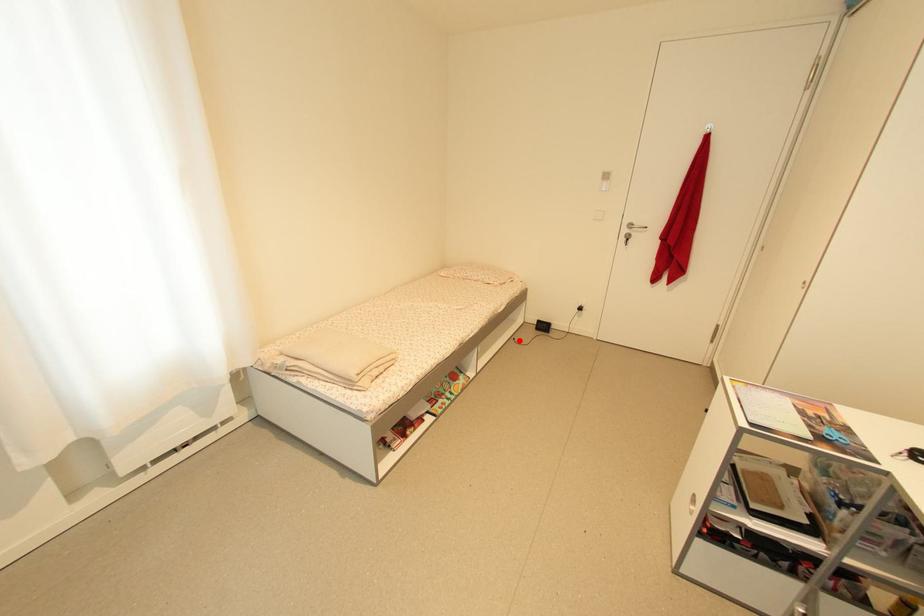
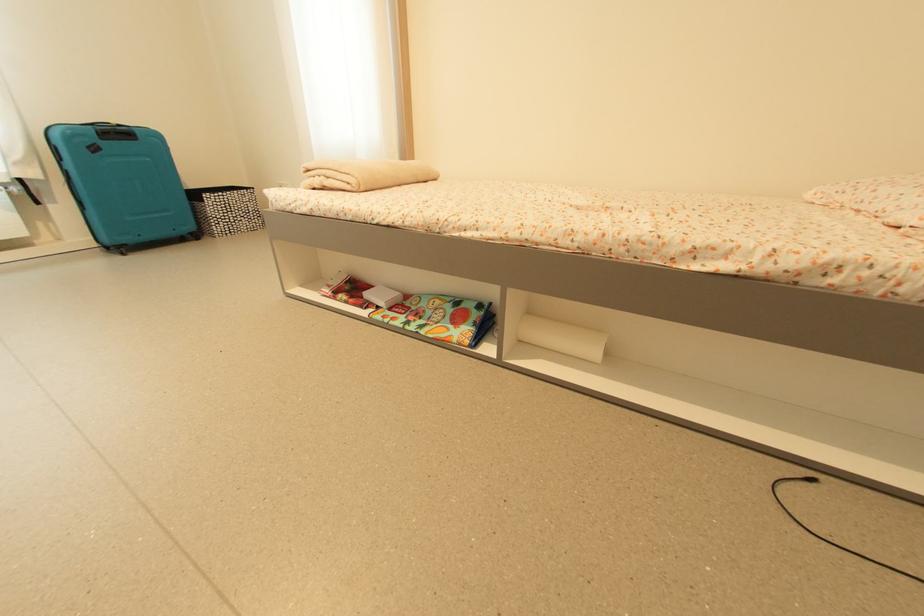
Question: I am providing you with two images of the same scene from different viewpoints. Given a red point in image1, look at the same physical point in image2. Is it:

Choices:
 (A) Closer to the viewpoint
 (B) Farther from the viewpoint

Answer: (A)